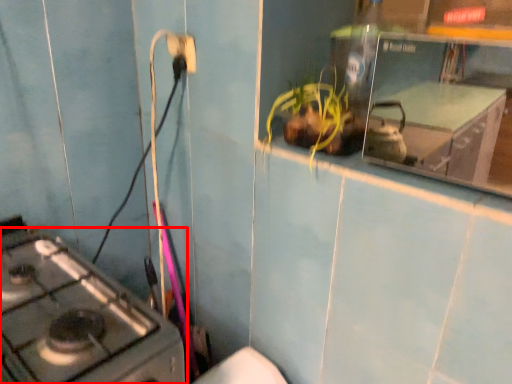
Question: From the image's perspective, what is the correct spatial positioning of gas stove (annotated by the red box) in reference to electric outlet?

Choices:
 (A) above
 (B) below

Answer: (B)